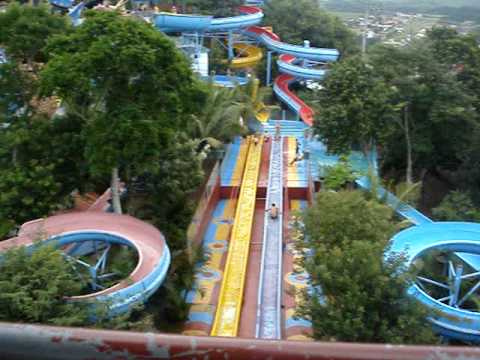
Locate an element on the screen. Image resolution: width=480 pixels, height=360 pixels. bottom right rail where paint has chipped off is located at coordinates (26, 340).